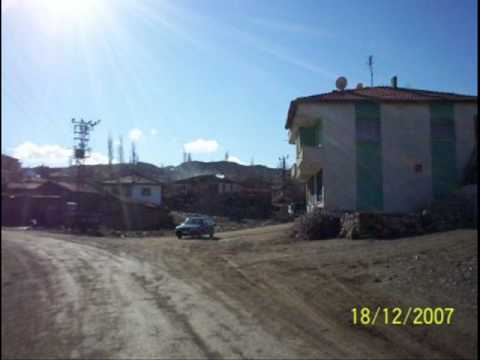
Locate an element on the screen. This screenshot has height=360, width=480. white wall is located at coordinates (403, 132).